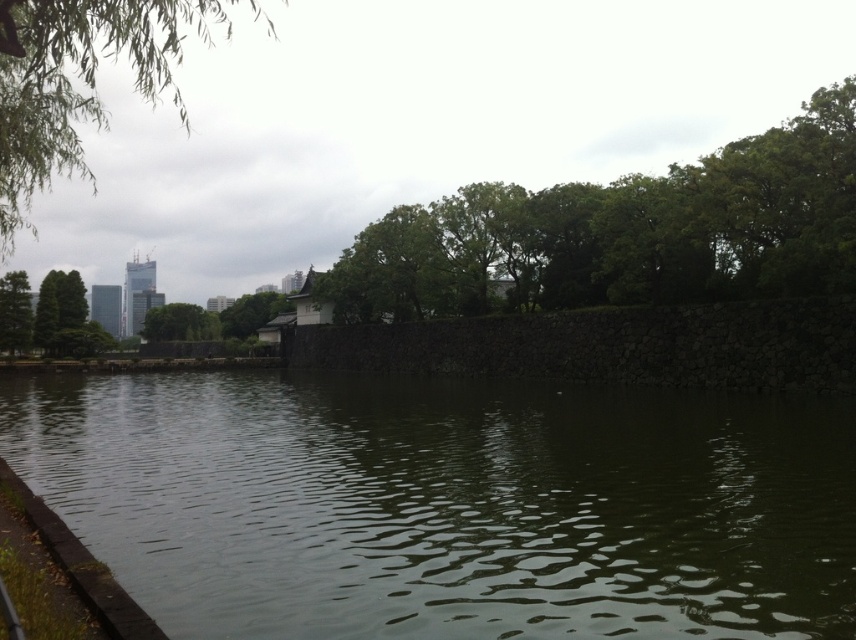
Question: Does greenish water at center appear over green leafy tree at left?

Choices:
 (A) no
 (B) yes

Answer: (A)

Question: Which point is farther from the camera taking this photo?

Choices:
 (A) (7, 349)
 (B) (853, 572)

Answer: (A)

Question: Which object is positioned closest to the greenish water at center?

Choices:
 (A) green leafy tree at center
 (B) green leafy tree at upper left

Answer: (B)

Question: Is greenish water at center closer to camera compared to green leafy tree at left?

Choices:
 (A) yes
 (B) no

Answer: (A)

Question: Which of the following is the farthest from the observer?

Choices:
 (A) (182, 468)
 (B) (7, 44)
 (C) (21, 323)
 (D) (214, 324)

Answer: (D)

Question: Can you confirm if green leafy tree at upper left is positioned to the left of green leafy tree at left?

Choices:
 (A) yes
 (B) no

Answer: (B)